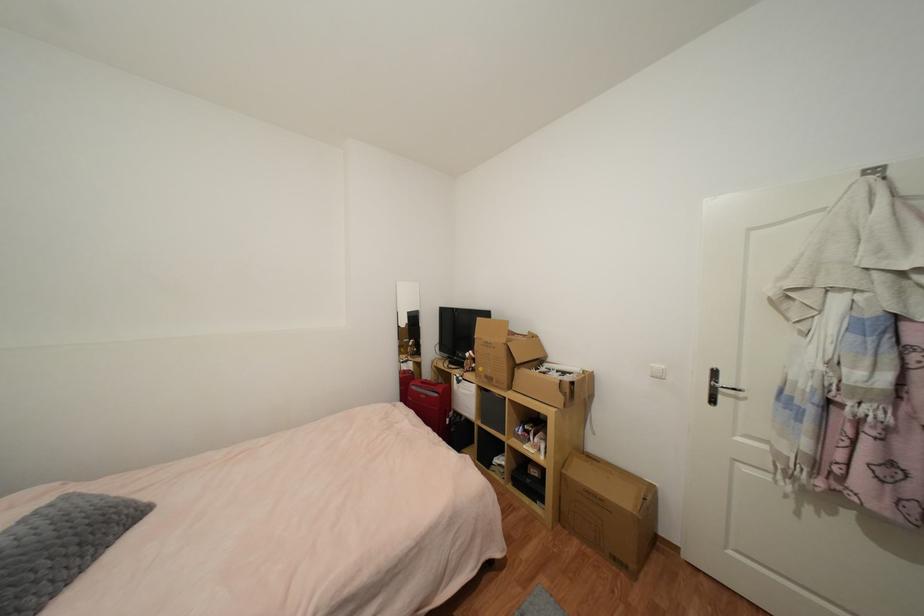
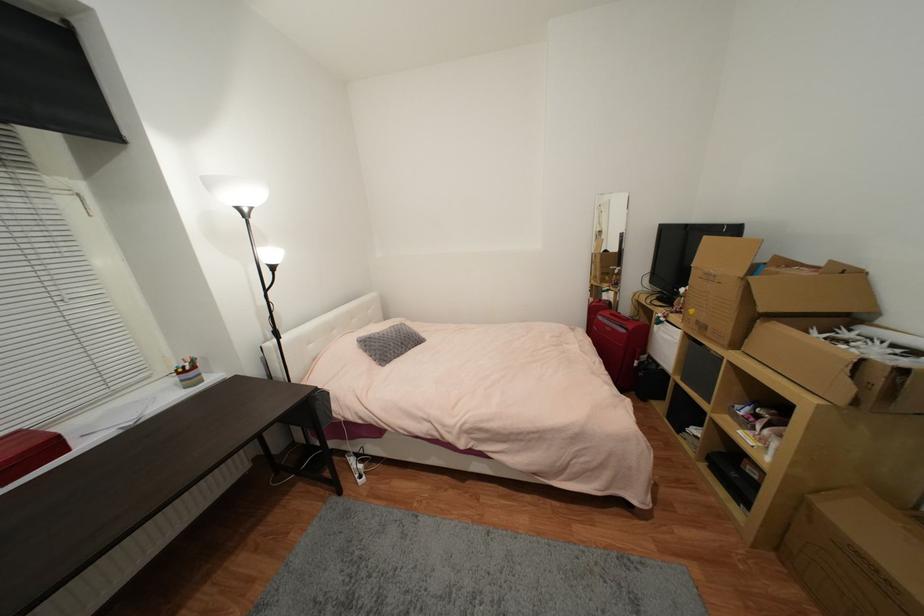
The point at (x=418, y=389) is marked in the first image. Where is the corresponding point in the second image?

(603, 318)